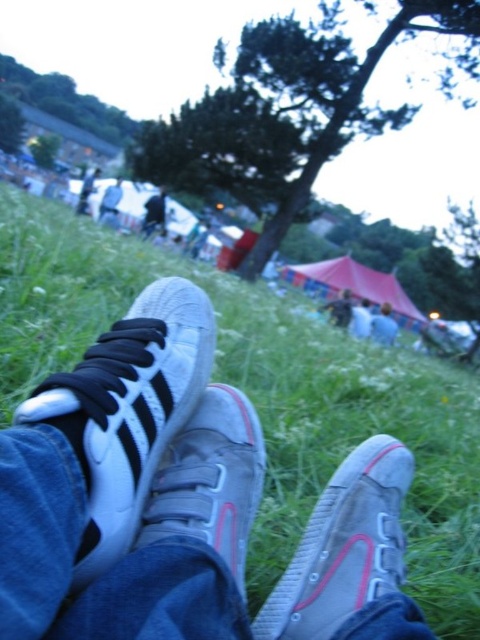
Question: Does white canvas shoe at lower center appear under gray canvas shoes at center?

Choices:
 (A) no
 (B) yes

Answer: (A)

Question: Is gray canvas shoe at lower right below denim jacket at lower right?

Choices:
 (A) yes
 (B) no

Answer: (A)

Question: Which object appears closest to the camera in this image?

Choices:
 (A) blue denim jeans at lower center
 (B) gray canvas shoe at lower right

Answer: (B)

Question: Estimate the real-world distances between objects in this image. Which object is farther from the green grassy field at lower center?

Choices:
 (A) white canvas shoe at lower center
 (B) denim jacket at lower right
 (C) black leather jacket at upper center
 (D) blue denim jeans at lower center

Answer: (A)

Question: Is gray canvas shoe at lower right to the right of gray canvas shoes at center from the viewer's perspective?

Choices:
 (A) yes
 (B) no

Answer: (B)

Question: Among these objects, which one is nearest to the camera?

Choices:
 (A) black leather jacket at upper center
 (B) gray suede sneaker at center
 (C) white leather sneaker at center
 (D) gray canvas shoes at center

Answer: (C)